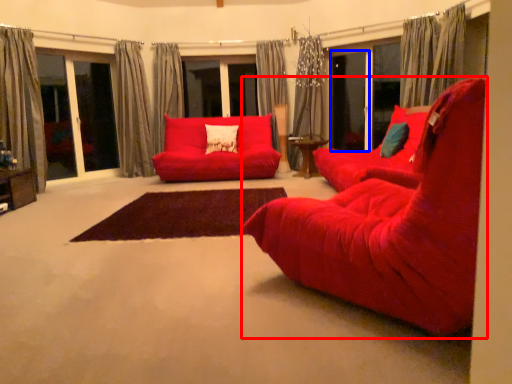
Question: Which object appears closest to the camera in this image, chair (highlighted by a red box) or screen door (highlighted by a blue box)?

Choices:
 (A) chair
 (B) screen door

Answer: (A)